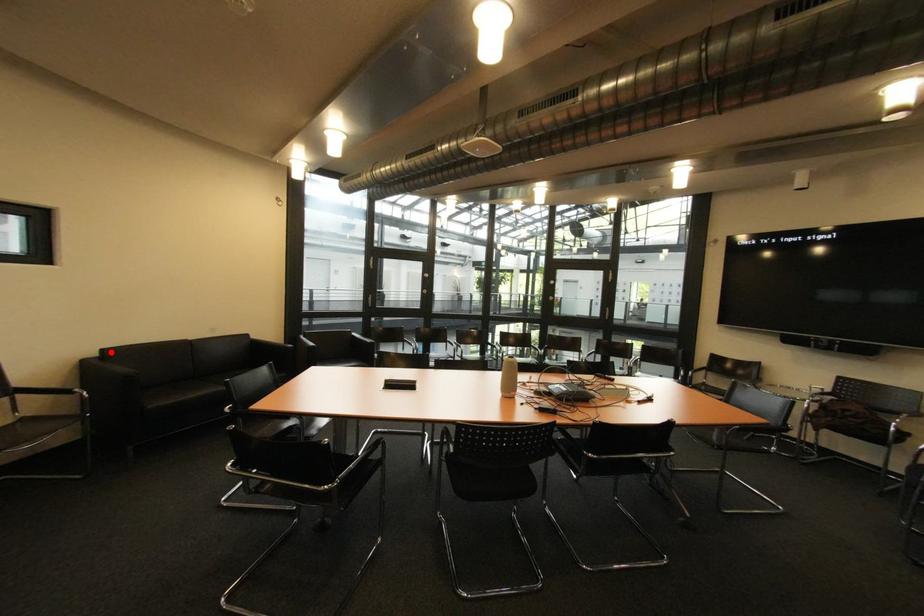
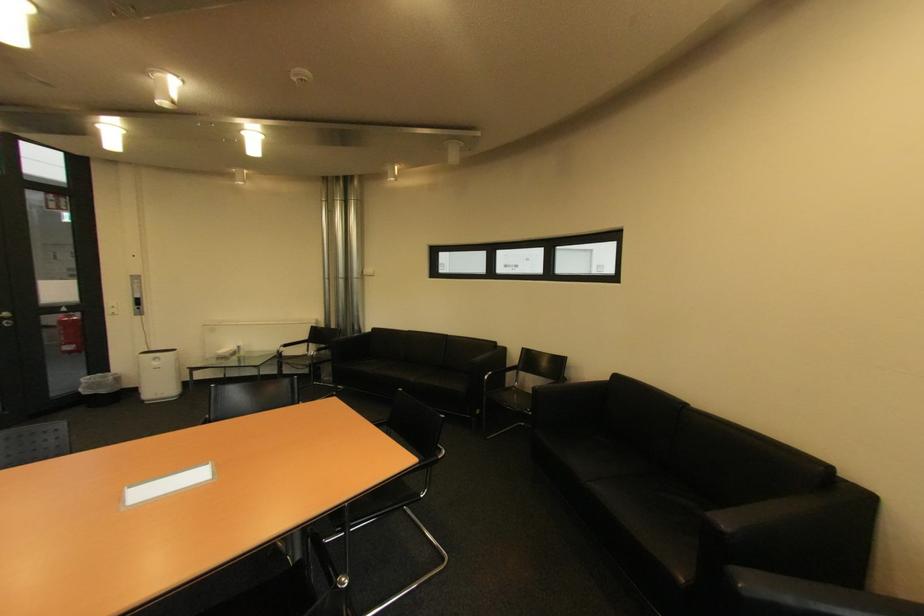
Where in the second image is the point corresponding to the highlighted location from the first image?

(625, 378)